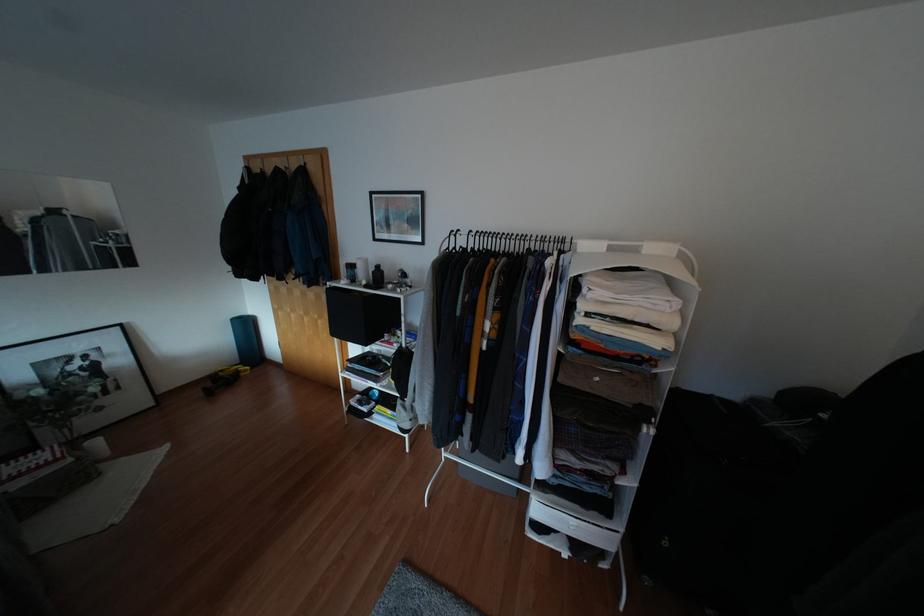
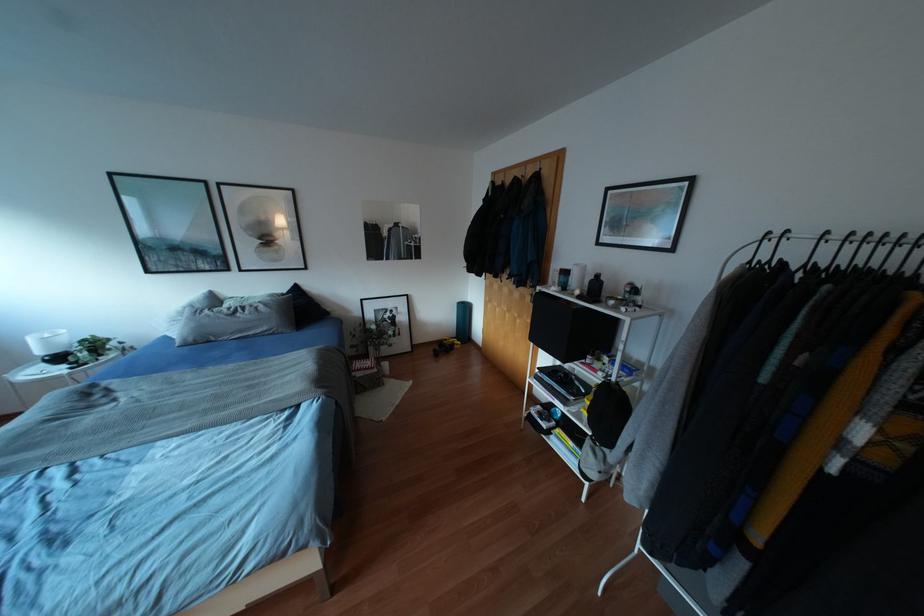
Question: Based on the continuous images, in which direction is the camera rotating? Reply with the corresponding letter.

Choices:
 (A) Left
 (B) Right
 (C) Up
 (D) Down

Answer: (A)